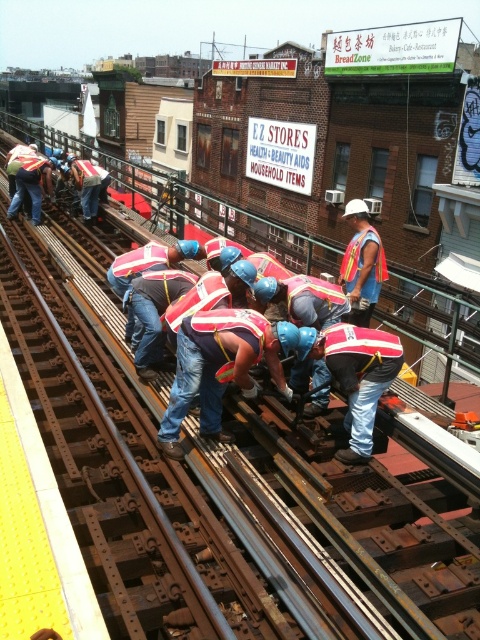
Question: Can you confirm if red reflective vest at center is positioned to the left of reflective orange vest at center?

Choices:
 (A) yes
 (B) no

Answer: (A)

Question: Which point appears closest to the camera in this image?

Choices:
 (A) (207, 417)
 (B) (376, 260)

Answer: (A)

Question: Is red reflective vest at center closer to camera compared to reflective orange vest at center?

Choices:
 (A) yes
 (B) no

Answer: (A)

Question: Can you confirm if reflective silver helmet at center is positioned above reflective orange vest at center?

Choices:
 (A) yes
 (B) no

Answer: (B)

Question: Which point appears farthest from the camera in this image?

Choices:
 (A) (259, 316)
 (B) (359, 236)

Answer: (B)

Question: Among these objects, which one is farthest from the camera?

Choices:
 (A) reflective orange vest at center
 (B) red reflective vest at center
 (C) reflective silver helmet at center

Answer: (A)